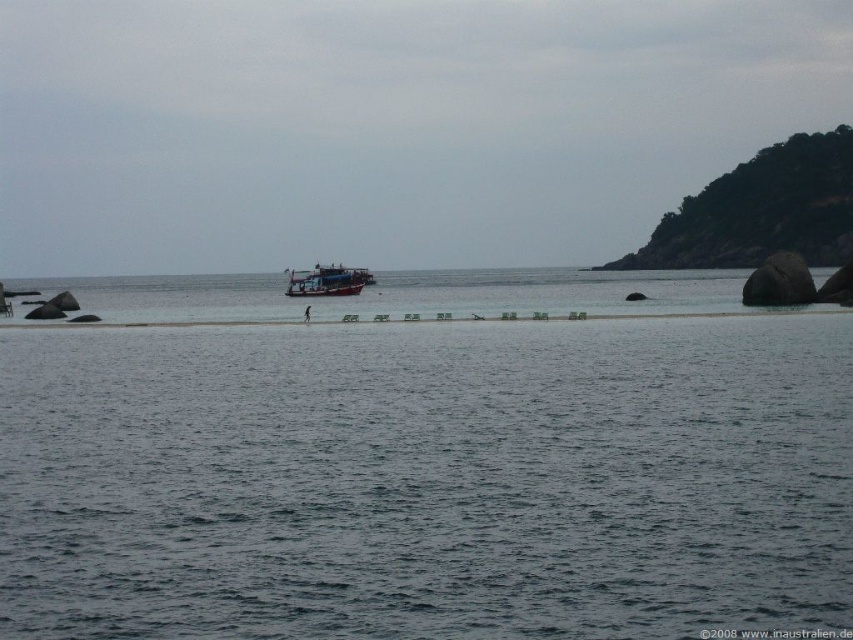
The image size is (853, 640). What do you see at coordinates (426, 480) in the screenshot?
I see `dark blue water at center` at bounding box center [426, 480].

Based on the photo, which of these two, dark blue water at center or wooden boat at center, stands taller?

Standing taller between the two is wooden boat at center.

What do you see at coordinates (426, 480) in the screenshot? This screenshot has height=640, width=853. I see `dark blue water at center` at bounding box center [426, 480].

In order to click on dark blue water at center in this screenshot , I will do `click(426, 480)`.